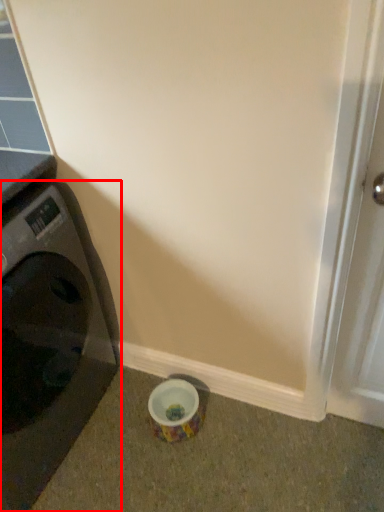
Question: From the image's perspective, what is the correct spatial positioning of washing machine (annotated by the red box) in reference to screen door?

Choices:
 (A) below
 (B) above

Answer: (A)